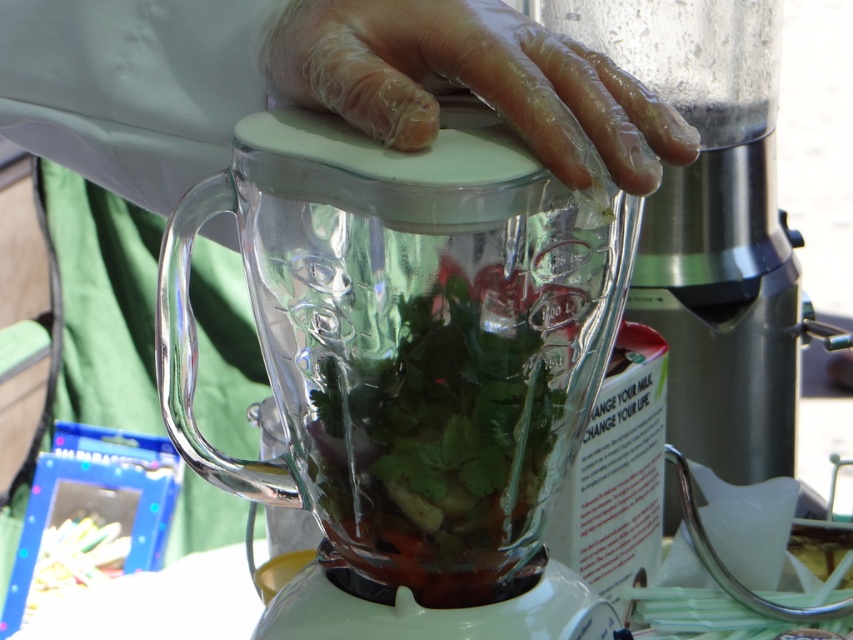
Does transparent glass blender at center come behind clear plastic glove at center?

No, it is in front of clear plastic glove at center.

Is point (602, 349) closer to camera compared to point (537, 67)?

No, it is not.

You are a GUI agent. You are given a task and a screenshot of the screen. Output one action in this format:
    pyautogui.click(x=<x>, y=<y>)
    Task: Click on the transparent glass blender at center
    Image resolution: width=853 pixels, height=640 pixels.
    Given the screenshot: What is the action you would take?
    pyautogui.click(x=409, y=368)

Identify the location of transparent glass blender at center. The width and height of the screenshot is (853, 640). (409, 368).

Between point (733, 228) and point (392, 52), which one is positioned behind?

The point (733, 228) is more distant.

Can you confirm if transparent glass food processor at center is shorter than clear plastic glove at center?

No, transparent glass food processor at center is not shorter than clear plastic glove at center.

Is point (811, 513) positioned behind point (450, 36)?

Yes, point (811, 513) is behind point (450, 36).

Where is `transparent glass food processor at center`? The height and width of the screenshot is (640, 853). transparent glass food processor at center is located at coordinates (712, 225).

From the picture: Does transparent glass blender at center have a smaller size compared to transparent glass food processor at center?

Indeed, transparent glass blender at center has a smaller size compared to transparent glass food processor at center.

Is transparent glass blender at center thinner than transparent glass food processor at center?

Correct, transparent glass blender at center's width is less than transparent glass food processor at center's.

Is point (236, 472) positioned after point (705, 35)?

No, (236, 472) is in front of (705, 35).

Find the location of a particular element. transparent glass blender at center is located at coordinates (409, 368).